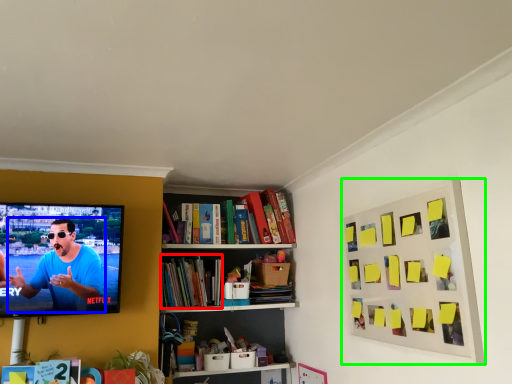
Question: Considering the real-world distances, which object is farthest from book (highlighted by a red box)? person (highlighted by a blue box) or picture frame (highlighted by a green box)?

Choices:
 (A) person
 (B) picture frame

Answer: (B)